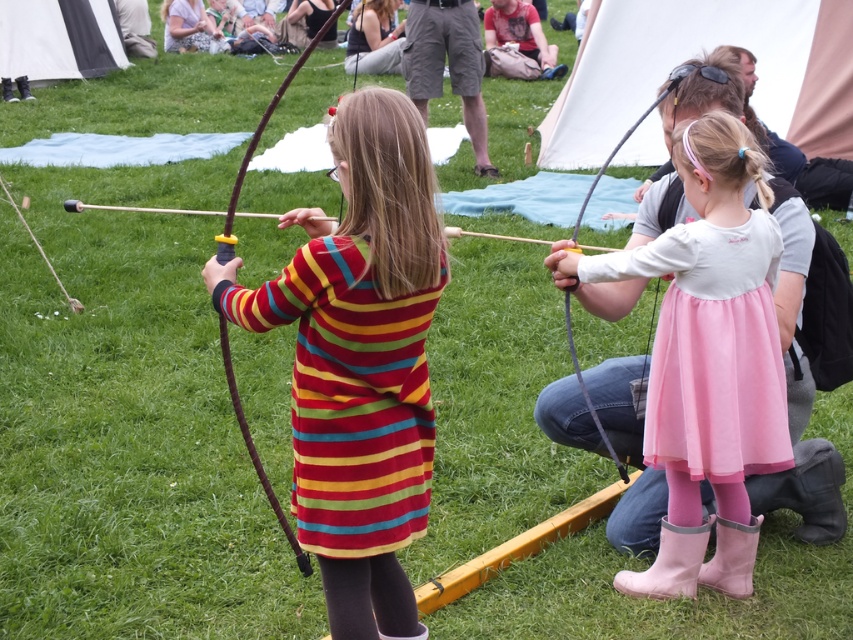
You are a photographer at the event and want to capture both the pink satin dress at center and the pink tulle dress at center in a single shot. Which dress should you focus on first to ensure both are in frame?

The pink satin dress at center is positioned under the pink tulle dress at center, so focusing on the pink tulle dress at center first will allow both dresses to be captured in the frame.

You are a photographer at the event and want to capture both the striped fabric dress at center and the pink tulle dress at center in a single frame. Which dress should you focus on first to ensure both are in the frame?

The striped fabric dress at center is larger in size than the pink tulle dress at center, so focus on the striped fabric dress at center first to ensure both fit within the frame.